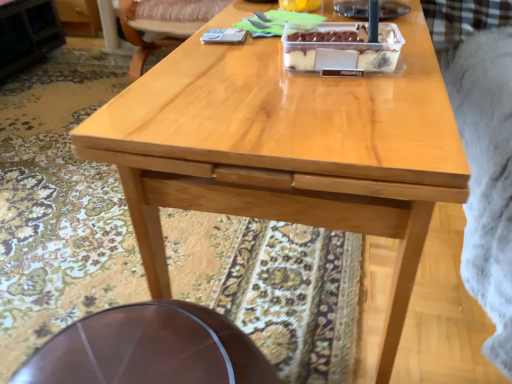
This screenshot has height=384, width=512. What do you see at coordinates (341, 47) in the screenshot?
I see `translucent plastic container at center` at bounding box center [341, 47].

Identify the location of wooden chair at upper center. This screenshot has width=512, height=384. (163, 24).

Image resolution: width=512 pixels, height=384 pixels. I want to click on shiny brown table at lower center, so click(x=149, y=349).

Consider the image. Is translucent plastic container at center bigger than shiny brown table at lower center?

Actually, translucent plastic container at center might be smaller than shiny brown table at lower center.

Considering the sizes of translucent plastic container at center and shiny brown table at lower center in the image, is translucent plastic container at center taller or shorter than shiny brown table at lower center?

In the image, translucent plastic container at center appears to be shorter than shiny brown table at lower center.

Where is `cake behind the shiny brown table at lower center`? This screenshot has height=384, width=512. cake behind the shiny brown table at lower center is located at coordinates (341, 47).

Which point is more forward, (361,39) or (59,377)?

The point (59,377) is more forward.

Is wooden chair at upper center oriented towards shiny brown table at lower center?

Yes, wooden chair at upper center is aimed at shiny brown table at lower center.

From the image's perspective, which one is positioned higher, wooden chair at upper center or shiny brown table at lower center?

wooden chair at upper center, from the image's perspective.

Which object is closer to the camera taking this photo, wooden chair at upper center or shiny brown table at lower center?

shiny brown table at lower center is closer to the camera.

Which is in front, point (186, 26) or point (86, 364)?

The point (86, 364) is closer to the camera.

Can you confirm if shiny brown table at lower center is wider than wooden chair at upper center?

No, shiny brown table at lower center is not wider than wooden chair at upper center.

Image resolution: width=512 pixels, height=384 pixels. What are the coordinates of `round table in front of the wooden chair at upper center` in the screenshot? It's located at (149, 349).

Between point (28, 360) and point (148, 21), which one is positioned in front?

Positioned in front is point (28, 360).

Locate an element on the screen. The width and height of the screenshot is (512, 384). cake above the wooden chair at upper center (from a real-world perspective) is located at coordinates (341, 47).

Who is shorter, translucent plastic container at center or wooden chair at upper center?

Standing shorter between the two is translucent plastic container at center.

Looking at this image, from a real-world perspective, who is located higher, translucent plastic container at center or wooden chair at upper center?

translucent plastic container at center, from a real-world perspective.

Which of these two, translucent plastic container at center or wooden chair at upper center, is bigger?

Bigger between the two is wooden chair at upper center.

Can we say wooden chair at upper center lies outside translucent plastic container at center?

wooden chair at upper center is positioned outside translucent plastic container at center.

Is wooden chair at upper center far from translucent plastic container at center?

wooden chair at upper center is positioned a significant distance from translucent plastic container at center.

Does wooden chair at upper center have a larger size compared to translucent plastic container at center?

Yes.

From the image's perspective, is wooden chair at upper center located beneath translucent plastic container at center?

No, from the image's perspective, wooden chair at upper center is not below translucent plastic container at center.

Is shiny brown table at lower center to the right of translucent plastic container at center from the viewer's perspective?

No, shiny brown table at lower center is not to the right of translucent plastic container at center.

Is shiny brown table at lower center completely or partially outside of translucent plastic container at center?

shiny brown table at lower center lies outside translucent plastic container at center's area.

From a real-world perspective, is shiny brown table at lower center located beneath translucent plastic container at center?

Indeed, from a real-world perspective, shiny brown table at lower center is positioned beneath translucent plastic container at center.

Locate an element on the screen. The image size is (512, 384). round table in front of the translucent plastic container at center is located at coordinates (149, 349).

At what (x,y) coordinates should I click in order to perform the action: click on round table below the wooden chair at upper center (from the image's perspective). Please return your answer as a coordinate pair (x, y). Looking at the image, I should click on (149, 349).

Based on their spatial positions, is shiny brown table at lower center or wooden chair at upper center further from translucent plastic container at center?

→ wooden chair at upper center.

Looking at this image, based on their spatial positions, is translucent plastic container at center or wooden chair at upper center further from shiny brown table at lower center?

wooden chair at upper center.

Considering their positions, is shiny brown table at lower center positioned closer to wooden chair at upper center than translucent plastic container at center?

translucent plastic container at center lies closer to wooden chair at upper center than the other object.

When comparing their distances from translucent plastic container at center, does wooden chair at upper center or shiny brown table at lower center seem closer?

The object closer to translucent plastic container at center is shiny brown table at lower center.

When comparing their distances from wooden chair at upper center, does translucent plastic container at center or shiny brown table at lower center seem closer?

The object closer to wooden chair at upper center is translucent plastic container at center.

From the image, which object appears to be nearer to shiny brown table at lower center, wooden chair at upper center or translucent plastic container at center?

translucent plastic container at center.

You are a GUI agent. You are given a task and a screenshot of the screen. Output one action in this format:
    pyautogui.click(x=<x>, y=<y>)
    Task: Click on the cake between shiny brown table at lower center and wooden chair at upper center along the z-axis
    
    Given the screenshot: What is the action you would take?
    pyautogui.click(x=341, y=47)